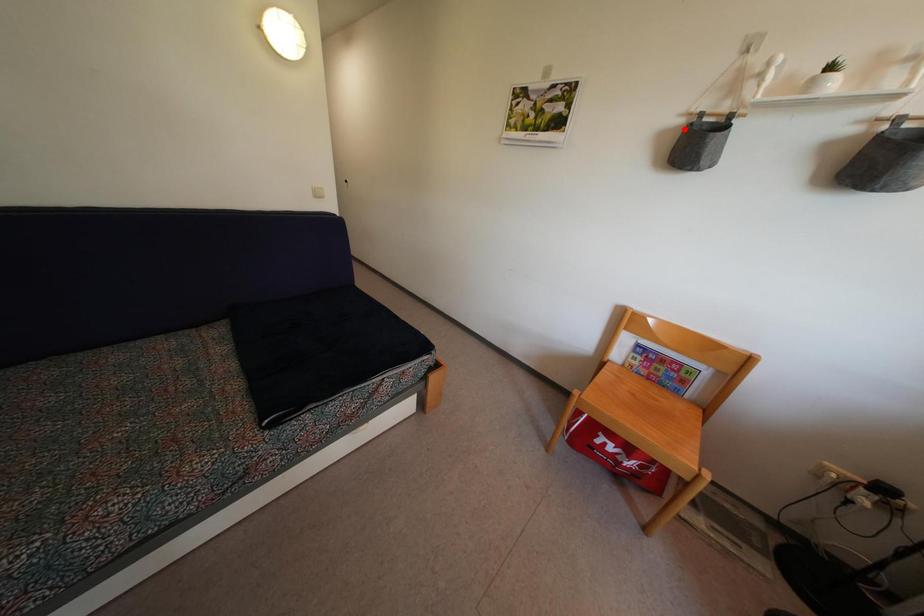
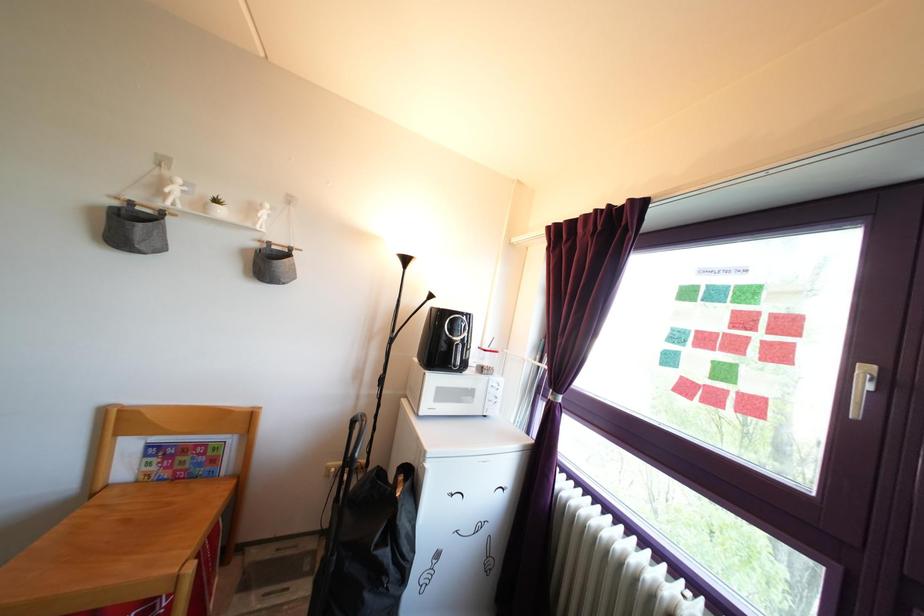
In the second image, find the point that corresponds to the highlighted location in the first image.

(118, 211)